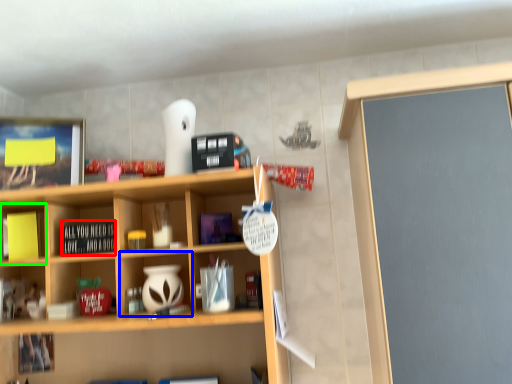
Question: Which is nearer to the book (highlighted by a red box)? cabinet (highlighted by a blue box) or cabinet (highlighted by a green box).

Choices:
 (A) cabinet
 (B) cabinet

Answer: (A)